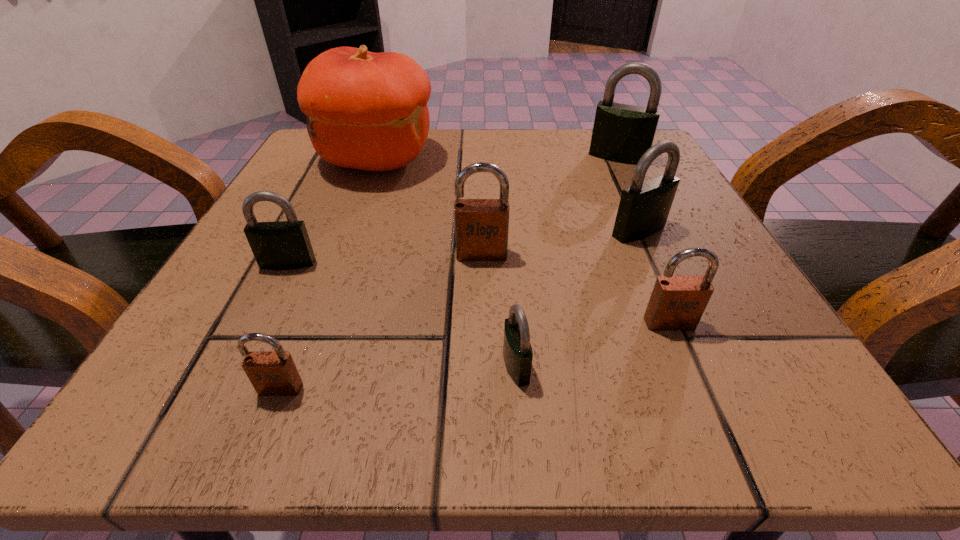
Image resolution: width=960 pixels, height=540 pixels. I want to click on vacant space located 0.060m on the front-facing side of the third nearest object, so click(689, 371).

At what (x,y) coordinates should I click in order to perform the action: click on vacant area situated 0.310m on the back of the smallest black padlock. Please return your answer as a coordinate pair (x, y). Looking at the image, I should click on (504, 205).

Identify the location of pumpkin at the far edge. (368, 111).

This screenshot has height=540, width=960. Identify the location of padlock that is positioned at the far edge. (622, 133).

At what (x,y) coordinates should I click in order to perform the action: click on pumpkin that is at the left edge. Please return your answer as a coordinate pair (x, y). This screenshot has width=960, height=540. Looking at the image, I should click on (368, 111).

The image size is (960, 540). I want to click on object located at the far left corner, so click(368, 111).

Locate an element on the screen. The height and width of the screenshot is (540, 960). object that is at the near left corner is located at coordinates (272, 373).

Identify the location of object that is positioned at the far right corner. The image size is (960, 540). (622, 133).

This screenshot has height=540, width=960. What are the coordinates of `vacant space at the far edge of the desktop` in the screenshot? It's located at click(x=463, y=153).

Where is `free region at the near edge`? This screenshot has width=960, height=540. free region at the near edge is located at coordinates (534, 420).